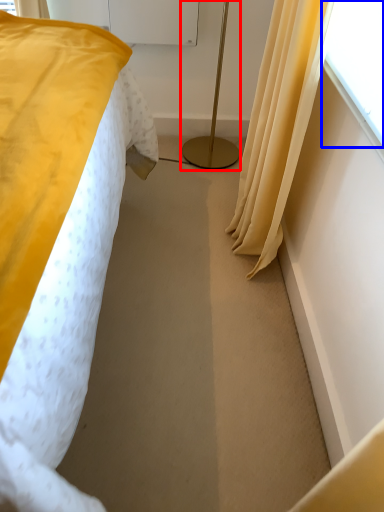
Question: Among these objects, which one is farthest to the camera, bedside lamp (highlighted by a red box) or window screen (highlighted by a blue box)?

Choices:
 (A) bedside lamp
 (B) window screen

Answer: (A)